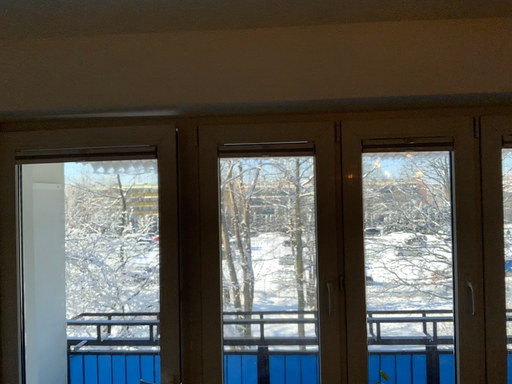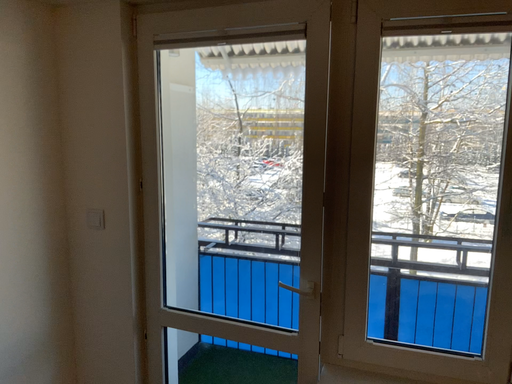
Question: Which way did the camera rotate in the video?

Choices:
 (A) rotated downward
 (B) rotated upward

Answer: (A)